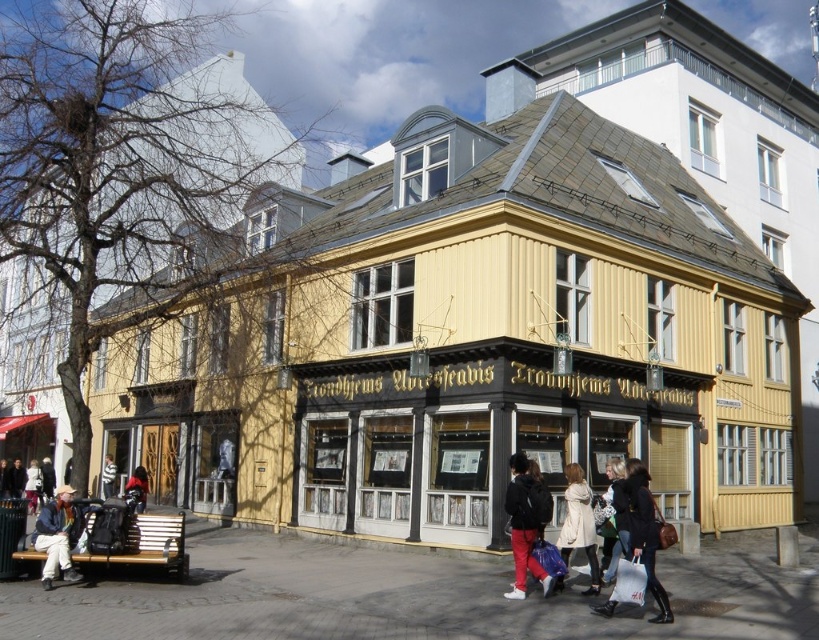
You are a customer looking to buy a jacket. You see two jackets displayed in the window of Trondheim Avisen, the black leather jacket at lower center and the light brown leather jacket at lower left. Which jacket is taller?

The black leather jacket at lower center is taller than the light brown leather jacket at lower left.

In the scene shown: You are standing at the corner of the street where the Trondheim Avisen building is located. You see a dark brown leather jacket at lower left. Where exactly is the dark brown leather jacket located in relation to the building?

The dark brown leather jacket at lower left is located at the 2D coordinates point (14, 477) relative to the building.